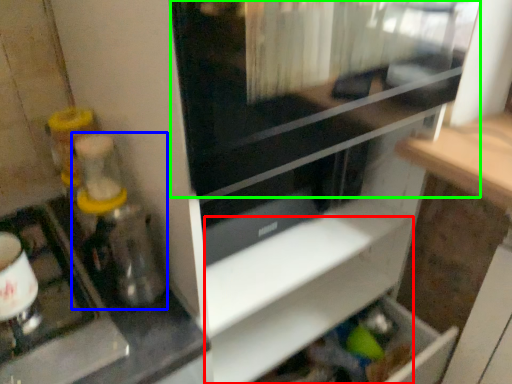
Question: Which object is the farthest from shelf (highlighted by a red box)? Choose among these: blender (highlighted by a blue box) or screen door (highlighted by a green box).

Choices:
 (A) blender
 (B) screen door

Answer: (B)